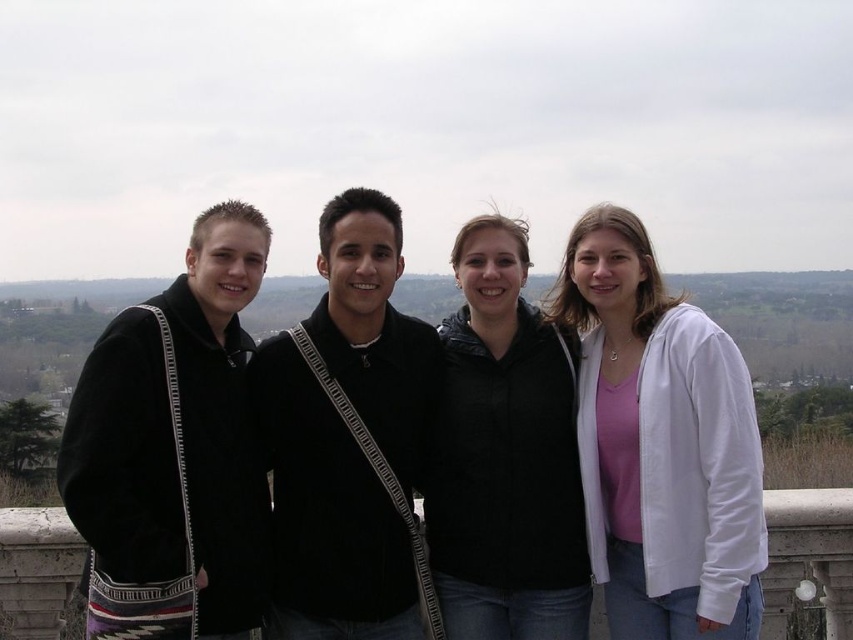
Question: Is white cotton jacket at right thinner than black jacket at center?

Choices:
 (A) yes
 (B) no

Answer: (B)

Question: Is the position of white cotton jacket at right less distant than that of black jacket at center?

Choices:
 (A) yes
 (B) no

Answer: (A)

Question: Is white cotton jacket at right below black jacket at center?

Choices:
 (A) no
 (B) yes

Answer: (A)

Question: Which point is closer to the camera taking this photo?

Choices:
 (A) (498, 356)
 (B) (654, 529)

Answer: (B)